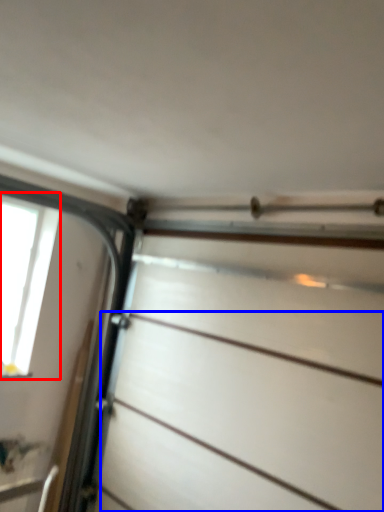
Question: Which point is further to the camera, window (highlighted by a red box) or drawer (highlighted by a blue box)?

Choices:
 (A) window
 (B) drawer

Answer: (A)